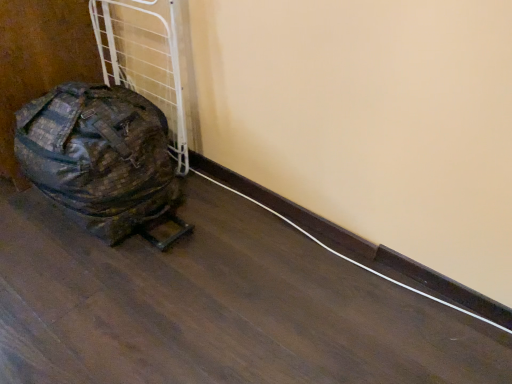
This screenshot has height=384, width=512. Describe the element at coordinates (100, 158) in the screenshot. I see `camouflage fabric bag at left` at that location.

Based on the photo, measure the distance between point (62,161) and camera.

The depth of point (62,161) is 1.33 meters.

Where is `camouflage fabric bag at left`? Image resolution: width=512 pixels, height=384 pixels. camouflage fabric bag at left is located at coordinates (100, 158).

The image size is (512, 384). Identify the location of white cable at lower center. (350, 258).

Measure the distance between point (328,249) and camera.

Point (328,249) and camera are 1.47 meters apart from each other.

This screenshot has height=384, width=512. What do you see at coordinates (350, 258) in the screenshot?
I see `white cable at lower center` at bounding box center [350, 258].

Find the location of a particular element. camouflage fabric bag at left is located at coordinates (100, 158).

Is white cable at lower center at the right side of camouflage fabric bag at left?

Yes.

Is the position of white cable at lower center more distant than that of camouflage fabric bag at left?

Yes, white cable at lower center is behind camouflage fabric bag at left.

Is point (415, 290) closer to viewer compared to point (155, 151)?

Yes, point (415, 290) is closer to viewer.

From the image's perspective, is white cable at lower center under camouflage fabric bag at left?

Indeed, from the image's perspective, white cable at lower center is shown beneath camouflage fabric bag at left.

From a real-world perspective, is white cable at lower center above or below camouflage fabric bag at left?

Clearly, from a real-world perspective, white cable at lower center is below camouflage fabric bag at left.

Between white cable at lower center and camouflage fabric bag at left, which one has smaller width?

With smaller width is white cable at lower center.

Is white cable at lower center taller than camouflage fabric bag at left?

In fact, white cable at lower center may be shorter than camouflage fabric bag at left.

Can you confirm if white cable at lower center is smaller than camouflage fabric bag at left?

Correct, white cable at lower center occupies less space than camouflage fabric bag at left.

Is camouflage fabric bag at left inside white cable at lower center?

Actually, camouflage fabric bag at left is outside white cable at lower center.

Would you say white cable at lower center is a long distance from camouflage fabric bag at left?

That's not correct — white cable at lower center is a little close to camouflage fabric bag at left.

Is white cable at lower center oriented towards camouflage fabric bag at left?

No.

What's the angular difference between white cable at lower center and camouflage fabric bag at left's facing directions?

white cable at lower center and camouflage fabric bag at left are facing 2.42 degrees away from each other.

The width and height of the screenshot is (512, 384). Find the location of `wire behind the camouflage fabric bag at left`. wire behind the camouflage fabric bag at left is located at coordinates (350, 258).

Considering the relative positions of camouflage fabric bag at left and white cable at lower center in the image provided, is camouflage fabric bag at left to the left or to the right of white cable at lower center?

camouflage fabric bag at left is to the left of white cable at lower center.

Considering the relative positions of camouflage fabric bag at left and white cable at lower center in the image provided, is camouflage fabric bag at left behind white cable at lower center?

No, it is not.

Does point (163, 184) lie behind point (408, 289)?

Yes, point (163, 184) is behind point (408, 289).

From the image's perspective, is camouflage fabric bag at left below white cable at lower center?

Actually, camouflage fabric bag at left appears above white cable at lower center in the image.

From a real-world perspective, between camouflage fabric bag at left and white cable at lower center, who is vertically higher?

camouflage fabric bag at left, from a real-world perspective.

Considering the sizes of objects camouflage fabric bag at left and white cable at lower center in the image provided, who is thinner, camouflage fabric bag at left or white cable at lower center?

With smaller width is white cable at lower center.

Between camouflage fabric bag at left and white cable at lower center, which one has less height?

white cable at lower center is shorter.

Does camouflage fabric bag at left have a larger size compared to white cable at lower center?

Indeed, camouflage fabric bag at left has a larger size compared to white cable at lower center.

Would you say camouflage fabric bag at left contains white cable at lower center?

No, white cable at lower center is not a part of camouflage fabric bag at left.

Is camouflage fabric bag at left placed right next to white cable at lower center?

camouflage fabric bag at left is not next to white cable at lower center, and they're not touching.

Is camouflage fabric bag at left oriented towards white cable at lower center?

No, camouflage fabric bag at left does not turn towards white cable at lower center.

The width and height of the screenshot is (512, 384). There is a white cable at lower center. Identify the location of luggage and bags above it (from a real-world perspective). (100, 158).

Image resolution: width=512 pixels, height=384 pixels. In order to click on luggage and bags on the left of white cable at lower center in this screenshot , I will do [100, 158].

Identify the location of wire located on the right of camouflage fabric bag at left. (350, 258).